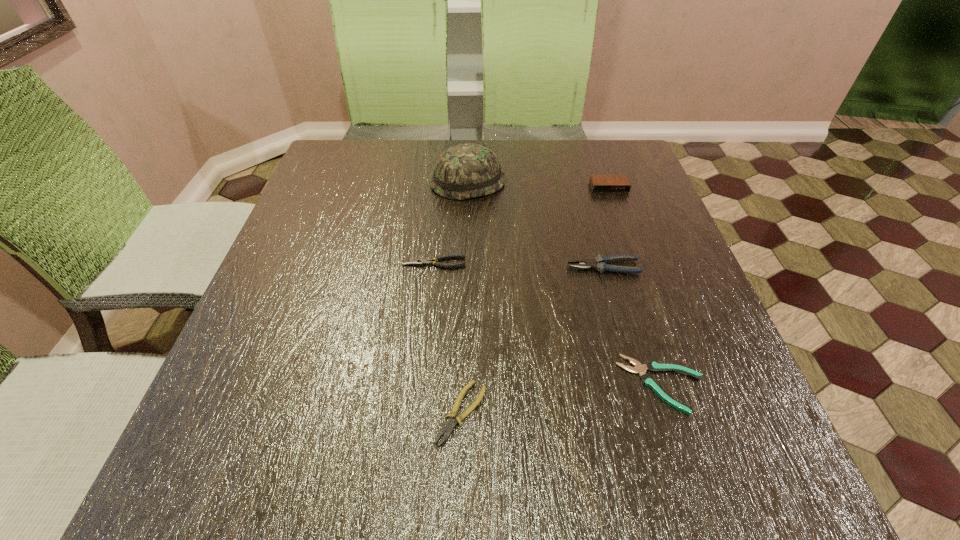
The height and width of the screenshot is (540, 960). In order to click on free space at the near left corner of the desktop in this screenshot , I will do click(x=277, y=476).

Where is `vacant space at the far right corner of the desktop`? vacant space at the far right corner of the desktop is located at coordinates (645, 177).

Locate an element on the screen. The height and width of the screenshot is (540, 960). blank space at the near right corner of the desktop is located at coordinates (742, 461).

In order to click on empty location between the second tallest pliers and the headwear in this screenshot , I will do pos(450,222).

Locate an element on the screen. blank region between the fifth shortest object and the headwear is located at coordinates (539, 185).

Find the location of a particular element. This screenshot has width=960, height=540. empty space that is in between the fifth shortest object and the headwear is located at coordinates (539, 185).

This screenshot has height=540, width=960. I want to click on empty location between the third shortest object and the tallest pliers, so click(x=518, y=265).

The width and height of the screenshot is (960, 540). Find the location of `vacant space that's between the alarm clock and the third shortest pliers`. vacant space that's between the alarm clock and the third shortest pliers is located at coordinates (521, 225).

Where is `empty space between the tallest object and the fourth tallest object`? empty space between the tallest object and the fourth tallest object is located at coordinates (450, 222).

Where is `object that stands as the closest to the second tallest object`? object that stands as the closest to the second tallest object is located at coordinates (464, 171).